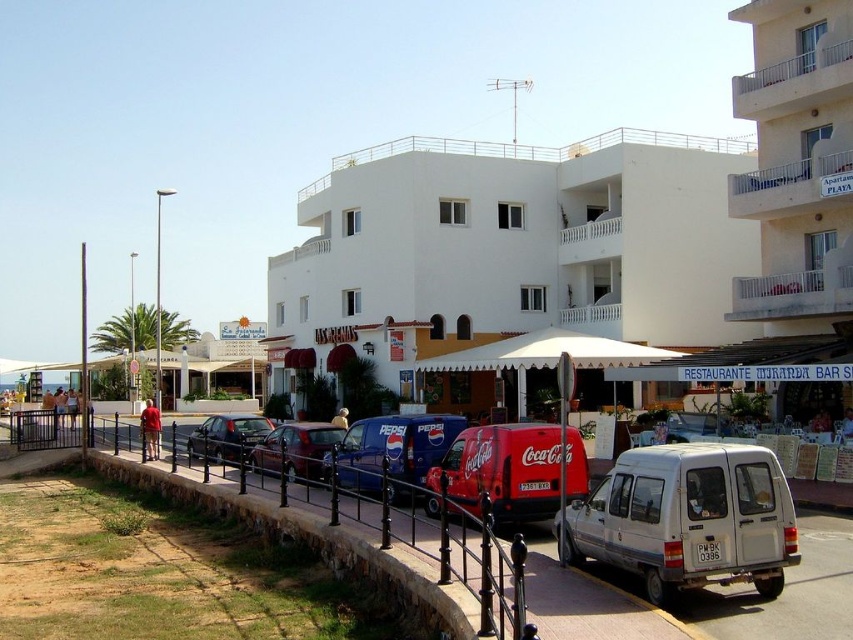
Question: Considering the relative positions of black metal fence at lower center and metallic red van at center in the image provided, where is black metal fence at lower center located with respect to metallic red van at center?

Choices:
 (A) left
 (B) right

Answer: (A)

Question: Based on their relative distances, which object is farther from the beige concrete building at center?

Choices:
 (A) shiny black sedan at center
 (B) silver metallic van at center
 (C) white matte building at center
 (D) black metal fence at lower center

Answer: (A)

Question: Among these points, which one is nearest to the camera?

Choices:
 (A) (212, 451)
 (B) (831, 260)
 (C) (456, 550)

Answer: (C)

Question: Observing the image, what is the correct spatial positioning of white matte building at center in reference to matte red van at center?

Choices:
 (A) above
 (B) below

Answer: (A)

Question: Can you confirm if silver metallic van at center is smaller than black metal fence at lower center?

Choices:
 (A) yes
 (B) no

Answer: (A)

Question: Which object is positioned farthest from the matte red van at center?

Choices:
 (A) silver metallic van at center
 (B) shiny black sedan at center
 (C) white matte building at center

Answer: (C)